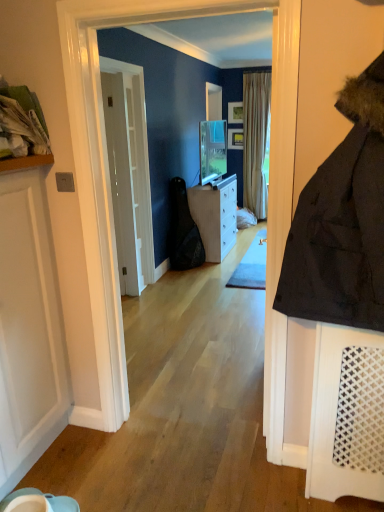
The height and width of the screenshot is (512, 384). What do you see at coordinates (215, 218) in the screenshot? I see `white glossy cabinet at center` at bounding box center [215, 218].

The width and height of the screenshot is (384, 512). Identify the location of white glossy cabinet at center. (215, 218).

Image resolution: width=384 pixels, height=512 pixels. What do you see at coordinates (21, 123) in the screenshot? I see `white fabric laundry at upper left` at bounding box center [21, 123].

You are a GUI agent. You are given a task and a screenshot of the screen. Output one action in this format:
    pyautogui.click(x=<x>, y=<y>)
    Task: Click on the white matte door at left, the 1th door viewed from the front
    The height and width of the screenshot is (512, 384).
    Given the screenshot: What is the action you would take?
    pyautogui.click(x=29, y=329)

This screenshot has height=512, width=384. Describe the element at coordinates (124, 179) in the screenshot. I see `white glossy door at center, the second door viewed from the front` at that location.

The width and height of the screenshot is (384, 512). In order to click on white glossy cabinet at center in this screenshot , I will do `click(215, 218)`.

Is white glossy cabinet at center looking in the opposite direction of white glossy door at center, the second door viewed from the front?

That's not correct — white glossy cabinet at center is not looking away from white glossy door at center, the second door viewed from the front.

Does white glossy cabinet at center have a greater width compared to white glossy door at center, the first door when ordered from back to front?

Indeed, white glossy cabinet at center has a greater width compared to white glossy door at center, the first door when ordered from back to front.

Does white glossy cabinet at center have a greater height compared to white glossy door at center, the second door viewed from the front?

In fact, white glossy cabinet at center may be shorter than white glossy door at center, the second door viewed from the front.

Based on the photo, is striped fabric curtain at center oriented away from white glossy door at center, the second door viewed from the front?

No.

Which of these two, striped fabric curtain at center or white glossy door at center, the second door viewed from the front, stands taller?

Standing taller between the two is striped fabric curtain at center.

Is striped fabric curtain at center positioned beyond the bounds of white glossy door at center, the second door viewed from the front?

Yes.

Can you confirm if striped fabric curtain at center is thinner than white glossy door at center, the second door viewed from the front?

Incorrect, the width of striped fabric curtain at center is not less than that of white glossy door at center, the second door viewed from the front.

Visually, is white matte door at left, marked as the 2th door in a back-to-front arrangement, positioned to the left or to the right of striped fabric curtain at center?

Clearly, white matte door at left, marked as the 2th door in a back-to-front arrangement, is on the left of striped fabric curtain at center in the image.

Can you tell me how much white matte door at left, marked as the 2th door in a back-to-front arrangement, and striped fabric curtain at center differ in facing direction?

white matte door at left, marked as the 2th door in a back-to-front arrangement, and striped fabric curtain at center are facing 90.2 degrees away from each other.

Could you tell me if white matte door at left, marked as the 2th door in a back-to-front arrangement, is facing striped fabric curtain at center?

No, white matte door at left, marked as the 2th door in a back-to-front arrangement, is not turned towards striped fabric curtain at center.

Are white matte door at left, the 1th door viewed from the front, and striped fabric curtain at center far apart?

Yes, white matte door at left, the 1th door viewed from the front, and striped fabric curtain at center are located far from each other.

Is white matte door at left, the 1th door viewed from the front, positioned with its back to white glossy door at center, the second door viewed from the front?

No, white glossy door at center, the second door viewed from the front, is not at the back of white matte door at left, the 1th door viewed from the front.

From a real-world perspective, which is physically below, white matte door at left, marked as the 2th door in a back-to-front arrangement, or white glossy door at center, the first door when ordered from back to front?

white matte door at left, marked as the 2th door in a back-to-front arrangement.

Which is more to the left, white matte door at left, the 1th door viewed from the front, or white glossy door at center, the first door when ordered from back to front?

white matte door at left, the 1th door viewed from the front, is more to the left.

Would you say white matte door at left, marked as the 2th door in a back-to-front arrangement, contains white glossy door at center, the first door when ordered from back to front?

No, white glossy door at center, the first door when ordered from back to front, is not inside white matte door at left, marked as the 2th door in a back-to-front arrangement.

Is white matte door at left, the 1th door viewed from the front, inside or outside of white fabric laundry at upper left?

white matte door at left, the 1th door viewed from the front, cannot be found inside white fabric laundry at upper left.

Consider the image. Considering the relative positions of white matte door at left, the 1th door viewed from the front, and white fabric laundry at upper left in the image provided, is white matte door at left, the 1th door viewed from the front, behind white fabric laundry at upper left?

No, the depth of white matte door at left, the 1th door viewed from the front, is less than that of white fabric laundry at upper left.

In the scene shown: Is white matte door at left, marked as the 2th door in a back-to-front arrangement, facing towards white fabric laundry at upper left?

No.

Does white matte door at left, marked as the 2th door in a back-to-front arrangement, appear on the right side of white fabric laundry at upper left?

Correct, you'll find white matte door at left, marked as the 2th door in a back-to-front arrangement, to the right of white fabric laundry at upper left.

In terms of width, does white glossy door at center, the second door viewed from the front, look wider or thinner when compared to striped fabric curtain at center?

Clearly, white glossy door at center, the second door viewed from the front, has less width compared to striped fabric curtain at center.

From a real-world perspective, count 1st doors downward from the striped fabric curtain at center and point to it. Please provide its 2D coordinates.

[(124, 179)]

Does white glossy door at center, the first door when ordered from back to front, have a smaller size compared to striped fabric curtain at center?

Correct, white glossy door at center, the first door when ordered from back to front, occupies less space than striped fabric curtain at center.

From a real-world perspective, is striped fabric curtain at center physically located above or below white fabric laundry at upper left?

striped fabric curtain at center is below white fabric laundry at upper left.

From the image's perspective, who appears lower, striped fabric curtain at center or white fabric laundry at upper left?

white fabric laundry at upper left, from the image's perspective.

How far apart are striped fabric curtain at center and white fabric laundry at upper left?

striped fabric curtain at center and white fabric laundry at upper left are 15.89 feet apart from each other.

Considering the relative positions of striped fabric curtain at center and white fabric laundry at upper left in the image provided, is striped fabric curtain at center to the left of white fabric laundry at upper left from the viewer's perspective?

No.

Where is `the 1st door counting from the left of the white glossy cabinet at center`? the 1st door counting from the left of the white glossy cabinet at center is located at coordinates (124, 179).

Find the location of `curtain above the white glossy door at center, the second door viewed from the front (from a real-world perspective)`. curtain above the white glossy door at center, the second door viewed from the front (from a real-world perspective) is located at coordinates (255, 140).

From the image, which object appears to be farther from striped fabric curtain at center, white glossy cabinet at center or white fabric laundry at upper left?

Among the two, white fabric laundry at upper left is located further to striped fabric curtain at center.

Looking at the image, which one is located closer to white fabric laundry at upper left, white glossy door at center, the second door viewed from the front, or striped fabric curtain at center?

Among the two, white glossy door at center, the second door viewed from the front, is located nearer to white fabric laundry at upper left.

Looking at the image, which one is located further to white glossy door at center, the second door viewed from the front, white matte door at left, the 1th door viewed from the front, or white fabric laundry at upper left?

Among the two, white fabric laundry at upper left is located further to white glossy door at center, the second door viewed from the front.

When comparing their distances from white glossy door at center, the first door when ordered from back to front, does striped fabric curtain at center or white fabric laundry at upper left seem closer?

white fabric laundry at upper left.

Which object lies further to the anchor point white glossy door at center, the first door when ordered from back to front, white glossy cabinet at center or white matte door at left, marked as the 2th door in a back-to-front arrangement?

white matte door at left, marked as the 2th door in a back-to-front arrangement, is positioned further to the anchor white glossy door at center, the first door when ordered from back to front.

Based on their spatial positions, is white matte door at left, marked as the 2th door in a back-to-front arrangement, or white glossy door at center, the second door viewed from the front, closer to white glossy cabinet at center?

Based on the image, white glossy door at center, the second door viewed from the front, appears to be nearer to white glossy cabinet at center.

Based on their spatial positions, is striped fabric curtain at center or white fabric laundry at upper left further from white glossy cabinet at center?

The object further to white glossy cabinet at center is white fabric laundry at upper left.

Based on their spatial positions, is white glossy cabinet at center or white fabric laundry at upper left further from white matte door at left, marked as the 2th door in a back-to-front arrangement?

Based on the image, white glossy cabinet at center appears to be further to white matte door at left, marked as the 2th door in a back-to-front arrangement.

The height and width of the screenshot is (512, 384). I want to click on door between white matte door at left, the 1th door viewed from the front, and striped fabric curtain at center, along the z-axis, so pyautogui.click(x=124, y=179).

The width and height of the screenshot is (384, 512). In order to click on laundry between white matte door at left, the 1th door viewed from the front, and white glossy cabinet at center in the front-back direction in this screenshot , I will do `click(21, 123)`.

Locate an element on the screen. laundry between white matte door at left, marked as the 2th door in a back-to-front arrangement, and striped fabric curtain at center from front to back is located at coordinates (21, 123).

Find the location of a particular element. This screenshot has width=384, height=512. cabinetry positioned between white glossy door at center, the second door viewed from the front, and striped fabric curtain at center from near to far is located at coordinates (215, 218).